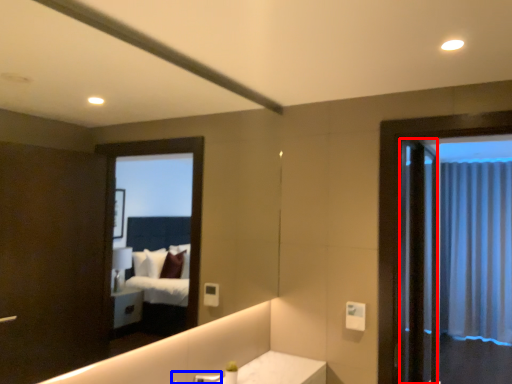
Question: Which object is further to the camera taking this photo, screen door (highlighted by a red box) or faucet (highlighted by a blue box)?

Choices:
 (A) screen door
 (B) faucet

Answer: (A)